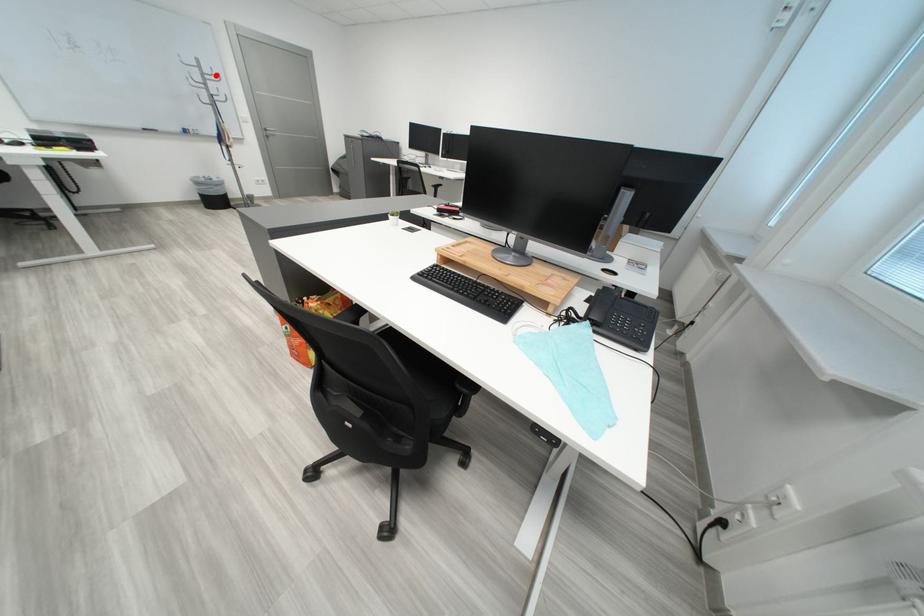
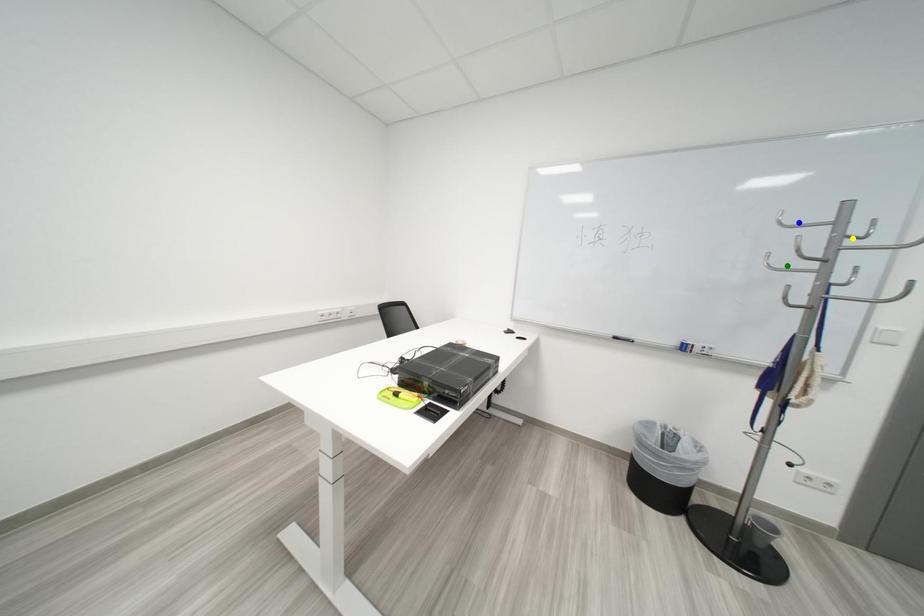
Question: I am providing you with two images of the same scene from different viewpoints. A red point is marked on the first image. You are given multiple points on the second image. Which point in image 2 represents the same 3d spot as the red point in image 1?

Choices:
 (A) yellow point
 (B) blue point
 (C) green point

Answer: (A)